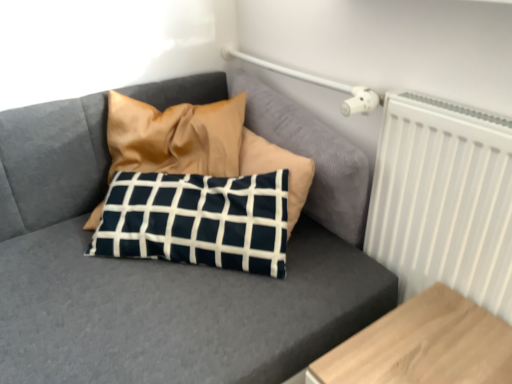
Question: From the image's perspective, relative to white matte radiator at upper right, is light brown wood table at lower right above or below?

Choices:
 (A) above
 (B) below

Answer: (B)

Question: From their relative heights in the image, would you say light brown wood table at lower right is taller or shorter than white matte radiator at upper right?

Choices:
 (A) short
 (B) tall

Answer: (A)

Question: Which is nearer to the light brown wood table at lower right?

Choices:
 (A) navy blue fabric pillow at center
 (B) white matte radiator at upper right

Answer: (B)

Question: Which of these objects is positioned closest to the white matte radiator at upper right?

Choices:
 (A) light brown wood table at lower right
 (B) navy blue fabric pillow at center

Answer: (A)